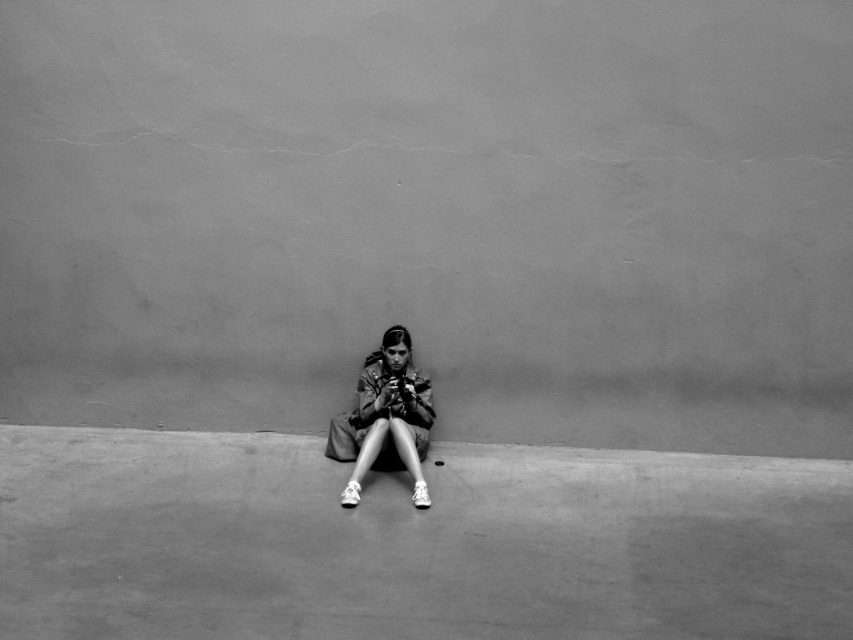
Consider the image. Based on the scene description, where exactly is the smooth concrete at center located in the image?

The smooth concrete at center is located at point coordinates of (413,541).